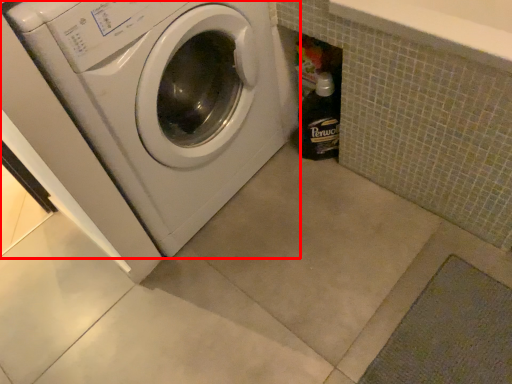
Question: Considering the relative positions of washing machine (annotated by the red box) and bottle in the image provided, where is washing machine (annotated by the red box) located with respect to the staircase?

Choices:
 (A) right
 (B) left

Answer: (B)